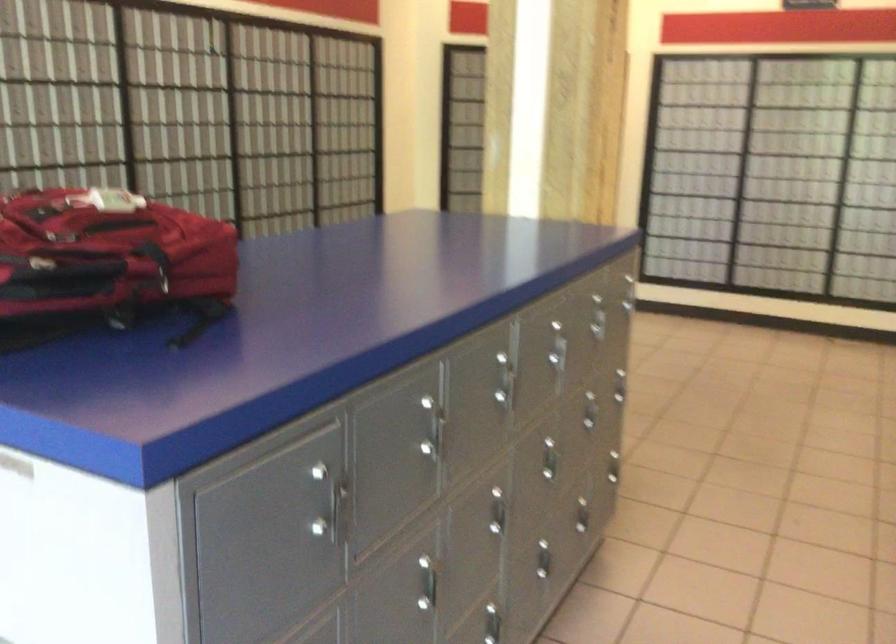
Locate an element on the screen. The image size is (896, 644). red backpack handle is located at coordinates (156, 263).